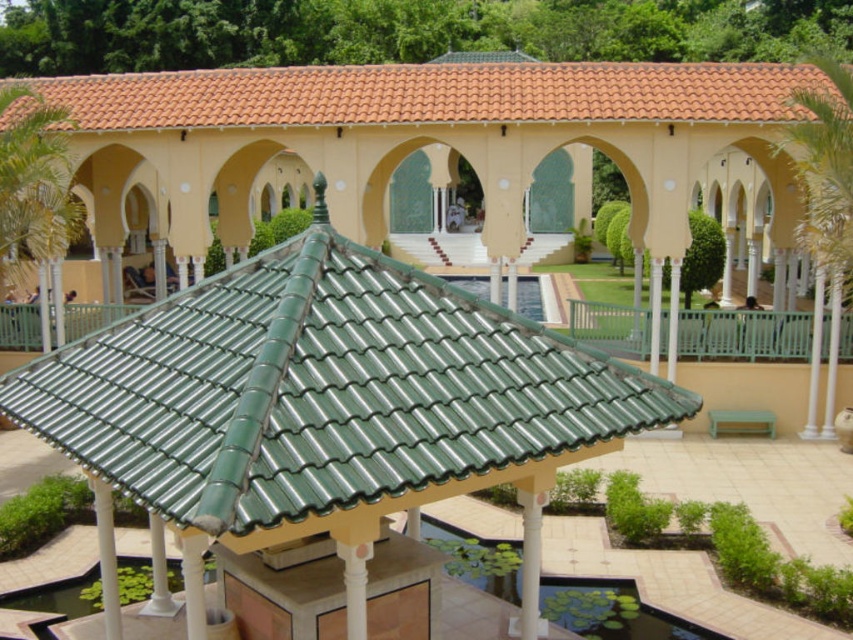
You are standing in the garden and want to take a photo of the green tile gazebo at center and the orange clay tiles at upper center. Which object will appear larger in your photo?

The green tile gazebo at center will appear larger in the photo because it is closer to the viewer than the orange clay tiles at upper center.

You are an architect designing a new garden layout and want to place a statue between the green tile gazebo at center and the orange clay tiles at upper center. Since you need to know which area is smaller to avoid blocking the view of the larger structure, which object occupies less space?

The green tile gazebo at center occupies less space than orange clay tiles at upper center, so placing the statue there would avoid blocking the view of the larger structure.

Consider the image. You are standing in the outdoor area and want to take a photo of the green tile gazebo at center and orange clay tiles at upper center. Which object should you position to the right side of your camera frame to include both in the shot?

You should position the orange clay tiles at upper center to the right side of your camera frame because the green tile gazebo at center is to the left of the orange clay tiles at upper center.